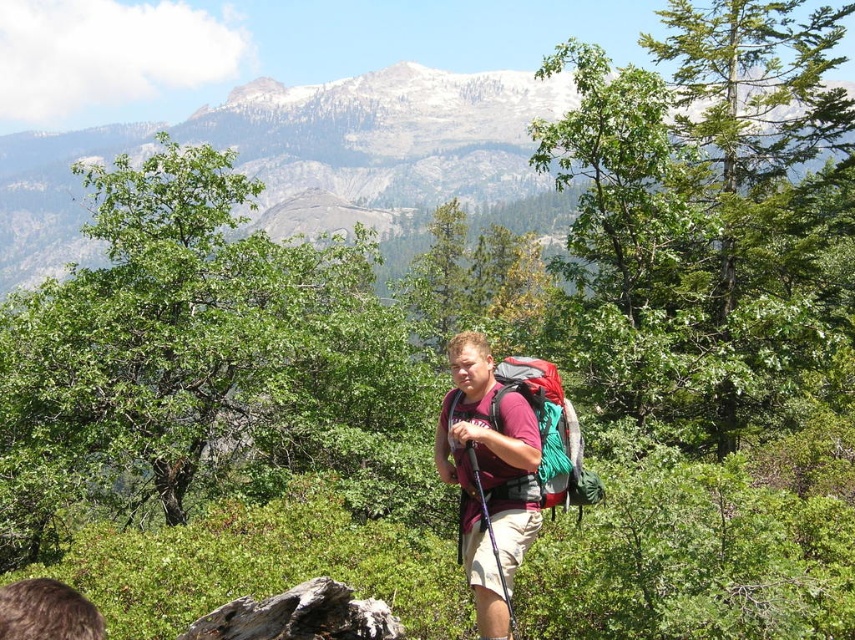
Question: Which of the following is the closest to the observer?

Choices:
 (A) snowy granite mountain at upper center
 (B) matte red backpack at center
 (C) matte red shirt at center

Answer: (B)

Question: Based on their relative distances, which object is farther from the matte red shirt at center?

Choices:
 (A) snowy granite mountain at upper center
 (B) matte red backpack at center

Answer: (A)

Question: Among these points, which one is farthest from the camera?

Choices:
 (A) (52, 177)
 (B) (496, 419)
 (C) (441, 401)

Answer: (A)

Question: Where is snowy granite mountain at upper center located in relation to matte red backpack at center in the image?

Choices:
 (A) below
 (B) above

Answer: (B)

Question: Can you confirm if snowy granite mountain at upper center is positioned above matte red backpack at center?

Choices:
 (A) no
 (B) yes

Answer: (B)

Question: Is snowy granite mountain at upper center closer to the viewer compared to matte red shirt at center?

Choices:
 (A) no
 (B) yes

Answer: (A)